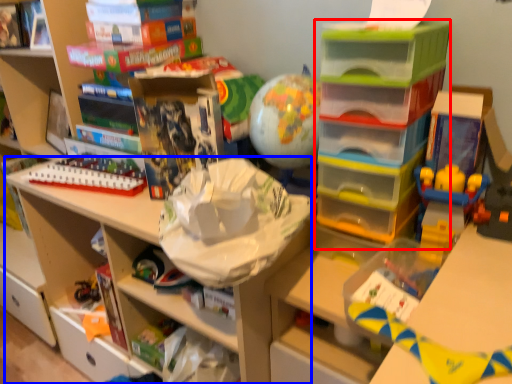
Question: Which of the following is the closest to the observer, shelf (highlighted by a red box) or shelf (highlighted by a blue box)?

Choices:
 (A) shelf
 (B) shelf

Answer: (A)